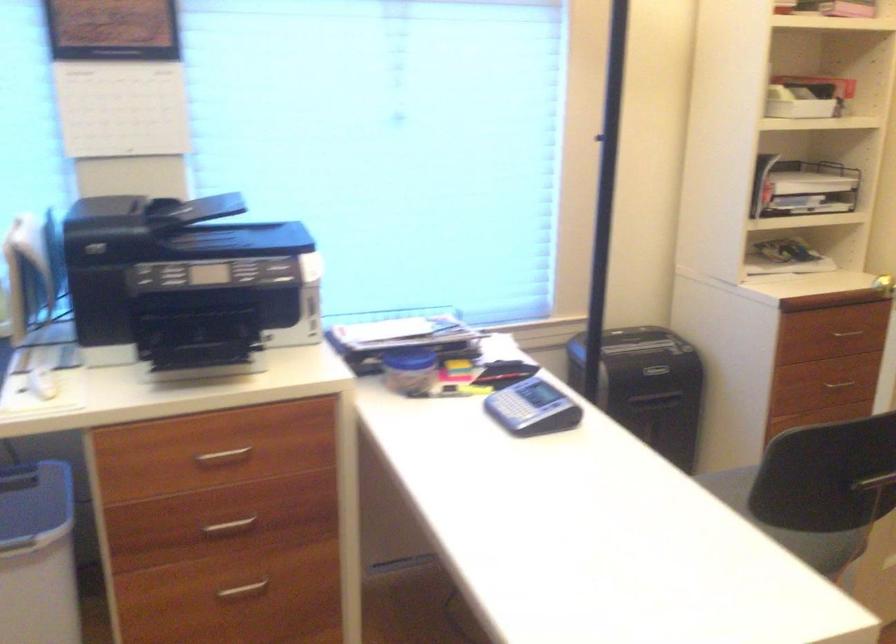
Where is `printer feeder tray`? Image resolution: width=896 pixels, height=644 pixels. printer feeder tray is located at coordinates (199, 209).